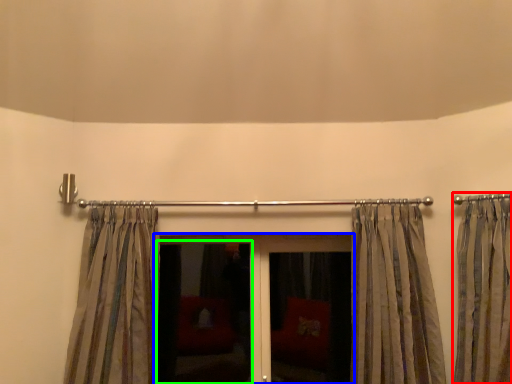
Question: Estimate the real-world distances between objects in this image. Which object is closer to curtain (highlighted by a red box), door (highlighted by a blue box) or screen door (highlighted by a green box)?

Choices:
 (A) door
 (B) screen door

Answer: (A)